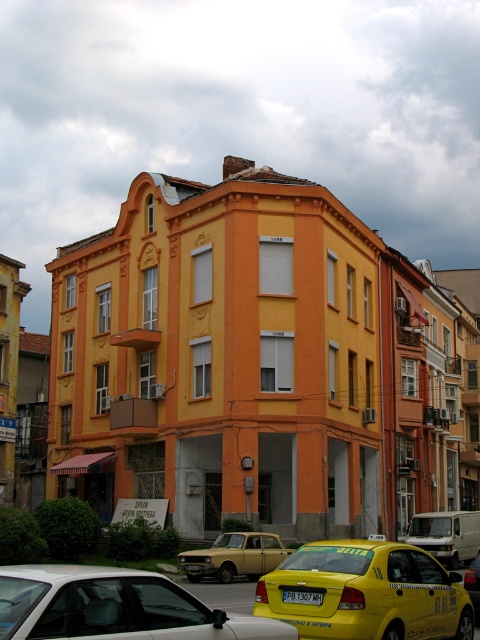
From the picture: Is gold metallic sedan at center wider than yellow metallic taxi at center?

In fact, gold metallic sedan at center might be narrower than yellow metallic taxi at center.

Does point (237, 564) lie in front of point (475, 518)?

Yes, it is.

Is point (200, 572) in front of point (477, 532)?

Yes, it is in front of point (477, 532).

You are a GUI agent. You are given a task and a screenshot of the screen. Output one action in this format:
    pyautogui.click(x=<x>, y=<y>)
    Task: Click on the gold metallic sedan at center
    This screenshot has height=640, width=480.
    Given the screenshot: What is the action you would take?
    pyautogui.click(x=235, y=556)

Between yellow matte taxi at lower center and yellow matte taxi at center, which one is positioned lower?

Positioned lower is yellow matte taxi at center.

Who is more forward, (444, 627) or (477, 579)?

Point (444, 627)

Where is `yellow matte taxi at lower center`? yellow matte taxi at lower center is located at coordinates (365, 593).

Can you confirm if gold metallic sedan at center is bigger than yellow matte taxi at center?

No, gold metallic sedan at center is not bigger than yellow matte taxi at center.

Where is `gold metallic sedan at center`? The height and width of the screenshot is (640, 480). gold metallic sedan at center is located at coordinates (235, 556).

Where is `gold metallic sedan at center`? gold metallic sedan at center is located at coordinates (235, 556).